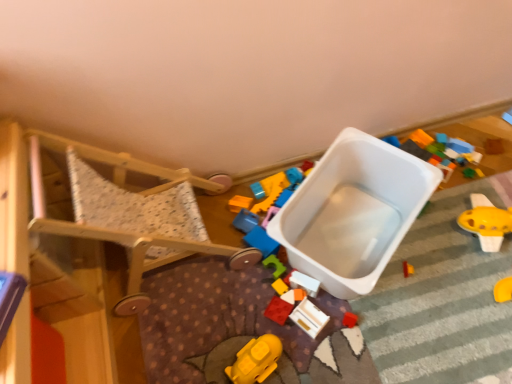
At what (x,y) coordinates should I click in order to perform the action: click on free space in front of rubber yellow toy at center, the 3th toy from the left. Please return your answer as a coordinate pair (x, y). The height and width of the screenshot is (384, 512). Looking at the image, I should click on (295, 335).